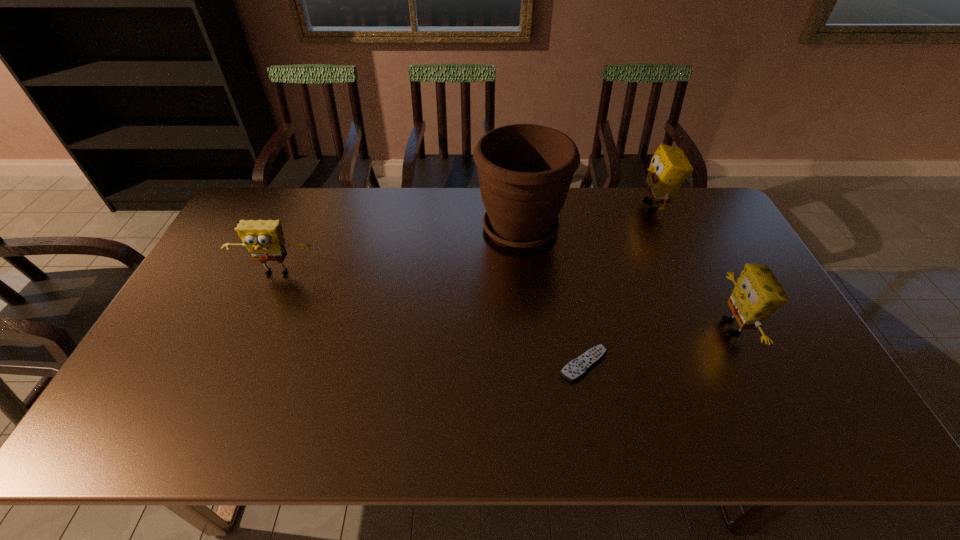
At what (x,y) coordinates should I click in order to perform the action: click on vacant region located 0.200m on the face of the nearest sponge. Please return your answer as a coordinate pair (x, y). Image resolution: width=960 pixels, height=540 pixels. Looking at the image, I should click on (642, 327).

What are the coordinates of `vacant space located on the face of the nearest sponge` in the screenshot? It's located at coord(676,327).

This screenshot has width=960, height=540. Find the location of `vacant region located 0.240m on the face of the nearest sponge`. vacant region located 0.240m on the face of the nearest sponge is located at coordinates (628, 327).

Identify the location of vacant space located on the face of the second nearest sponge. The width and height of the screenshot is (960, 540). (251, 333).

Where is `vacant space located 0.160m on the back of the remote control`? Image resolution: width=960 pixels, height=540 pixels. vacant space located 0.160m on the back of the remote control is located at coordinates (571, 300).

Where is `flowerpot that is positioned at the far edge`? The image size is (960, 540). flowerpot that is positioned at the far edge is located at coordinates (525, 170).

Where is `sponge located at the far edge`? sponge located at the far edge is located at coordinates (669, 168).

Where is `object located in the left edge section of the desktop`? object located in the left edge section of the desktop is located at coordinates (264, 240).

Where is `object located at the right edge`? object located at the right edge is located at coordinates (757, 294).

This screenshot has height=540, width=960. I want to click on vacant area at the far edge, so click(x=463, y=192).